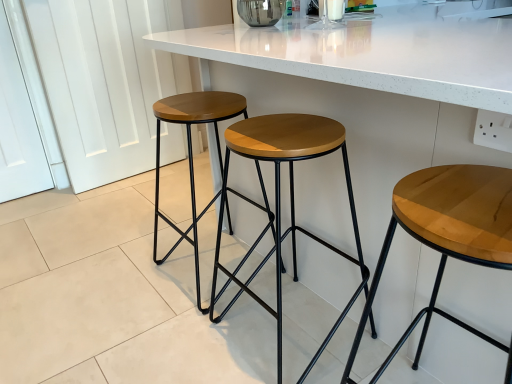
This screenshot has width=512, height=384. What are the coordinates of `vacant area situated to the left side of wooden/matte stool at center, which is the third stool from right to left` in the screenshot? It's located at (128, 275).